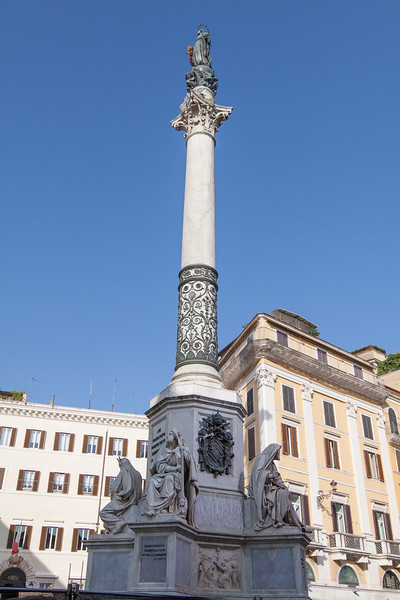
You are a GUI agent. You are given a task and a screenshot of the screen. Output one action in this format:
    pyautogui.click(x=<x>, y=<y>)
    Task: Click on the statue bases
    
    Given the screenshot: What is the action you would take?
    pyautogui.click(x=282, y=563), pyautogui.click(x=162, y=571), pyautogui.click(x=115, y=567)